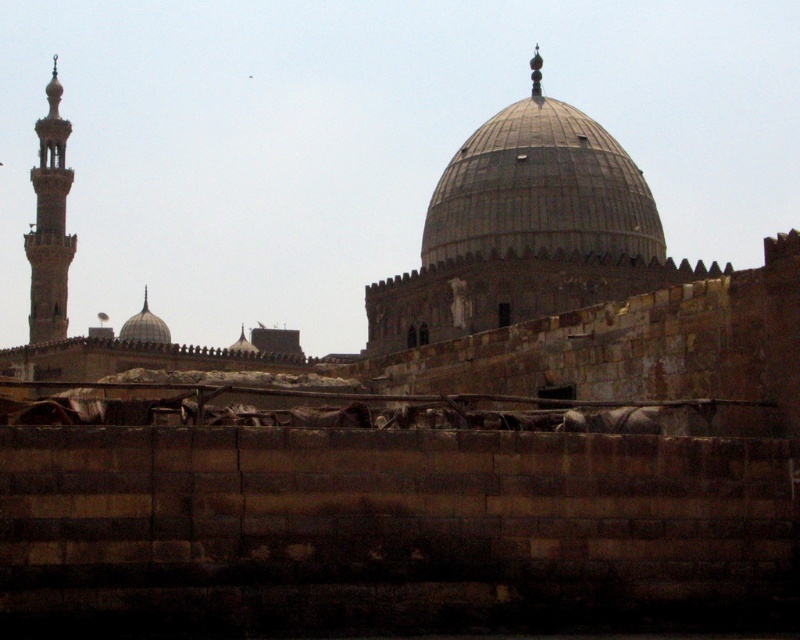
Who is lower down, gray stone dome at center or smooth stone minaret at left?

Positioned lower is gray stone dome at center.

Which is behind, point (656, 250) or point (30, 324)?

The point (30, 324) is behind.

Is point (562, 204) farther from viewer compared to point (24, 243)?

No.

I want to click on gray stone dome at center, so click(540, 188).

Does smooth stone minaret at left appear on the right side of matte gray dome at center?

In fact, smooth stone minaret at left is to the left of matte gray dome at center.

Is point (48, 237) positioned before point (144, 305)?

Yes, point (48, 237) is closer to viewer.

Locate an element on the screen. This screenshot has height=640, width=800. smooth stone minaret at left is located at coordinates (49, 225).

Does gray stone dome at center appear under matte gray dome at center?

No, gray stone dome at center is not below matte gray dome at center.

Based on the photo, does gray stone dome at center lie in front of matte gray dome at center?

Yes, gray stone dome at center is in front of matte gray dome at center.

Who is more distant from viewer, (540, 184) or (137, 314)?

Positioned behind is point (137, 314).

Locate an element on the screen. gray stone dome at center is located at coordinates (540, 188).